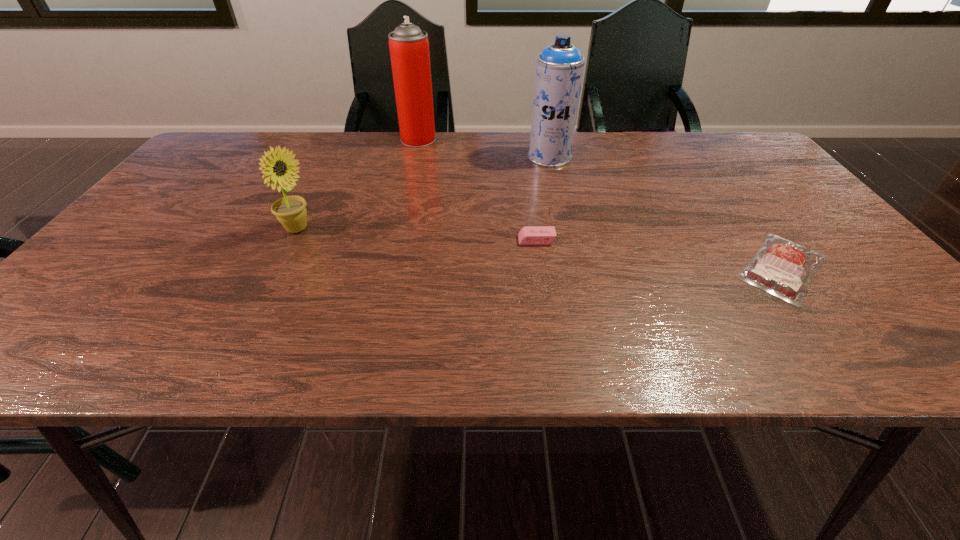
What are the coordinates of `blank space located on the back of the rightmost object` in the screenshot? It's located at (733, 203).

You are a GUI agent. You are given a task and a screenshot of the screen. Output one action in this format:
    pyautogui.click(x=<x>, y=<y>)
    Task: Click on the object that is at the right edge
    The width and height of the screenshot is (960, 540).
    Given the screenshot: What is the action you would take?
    pyautogui.click(x=783, y=268)

Image resolution: width=960 pixels, height=540 pixels. I want to click on free region at the far edge, so pyautogui.click(x=346, y=166).

In the image, there is a desktop. Where is `vacant space at the near edge`? vacant space at the near edge is located at coordinates (264, 325).

This screenshot has width=960, height=540. In the image, there is a desktop. What are the coordinates of `vacant space at the left edge` in the screenshot? It's located at (142, 277).

Locate an element on the screen. Image resolution: width=960 pixels, height=540 pixels. blank space at the right edge is located at coordinates (860, 307).

The image size is (960, 540). In the image, there is a desktop. What are the coordinates of `free region at the far right corner` in the screenshot? It's located at (717, 136).

This screenshot has height=540, width=960. In order to click on free spot at the near right corner of the desktop in this screenshot , I will do `click(879, 354)`.

Where is `vacant area that lies between the second object from left to right and the right aerosol can`? The height and width of the screenshot is (540, 960). vacant area that lies between the second object from left to right and the right aerosol can is located at coordinates (484, 148).

At what (x,y) coordinates should I click in order to perform the action: click on vacant region between the rightmost object and the right aerosol can. Please return your answer as a coordinate pair (x, y). This screenshot has width=960, height=540. Looking at the image, I should click on (666, 212).